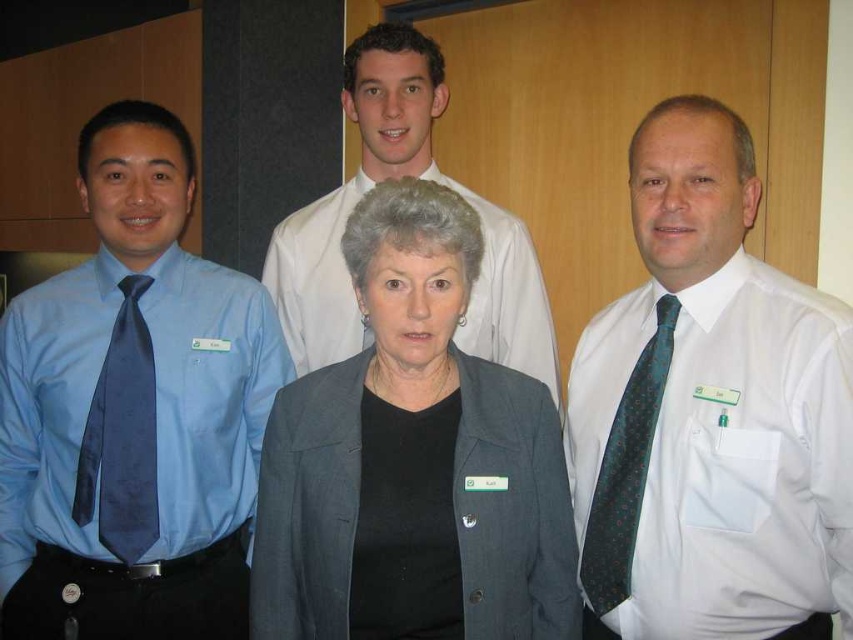
You are an event organizer arranging a photoshoot for the attendees. You need to ensure that the gray woolen blazer at center and the green dotted silk tie at right are visible in the frame. Based on their positions, which clothing item is covering part of the other?

The gray woolen blazer at center is positioned over the green dotted silk tie at right, so the blazer is covering part of the tie.

From the picture: You are attending a professional event and notice two men wearing ties. One has a matte blue tie at left and the other a green dotted silk tie at right. From your perspective, which tie appears closer to you?

The matte blue tie at left appears closer to you because the green dotted silk tie at right is positioned behind it.

You are organizing a charity event and need to arrange items on a table. The gray woolen blazer at center and the matte blue tie at left are to be placed next to each other. Which item should you place first if you want the larger item to occupy more space on the table?

The gray woolen blazer at center should be placed first because it is larger in size than the matte blue tie at left, allowing it to occupy more space on the table.